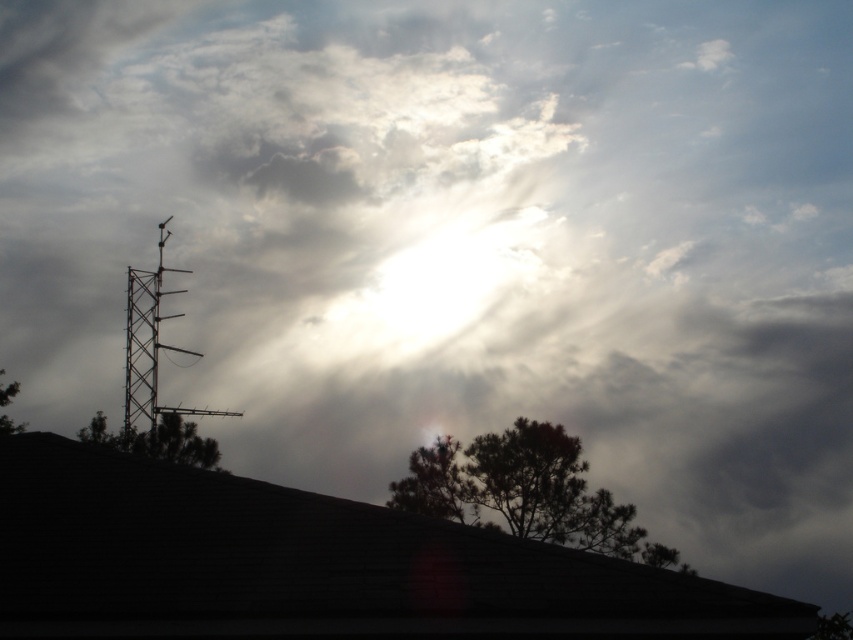
You are a bird looking for a nesting spot. You see the green matte tree at center and the green leafy tree at left. Which tree has a wider canopy to accommodate your nest?

The green matte tree at center might be wider than the green leafy tree at left, so it could provide a wider canopy for your nest.

You are standing in front of the roof with the antenna structure. You notice two points marked on the roof surface. The first point is at coordinate point (544, 509) and the second is at point (18, 428). Which point appears closer to you?

Point (544, 509) is closer to the camera than point (18, 428), so the first point appears closer to you.